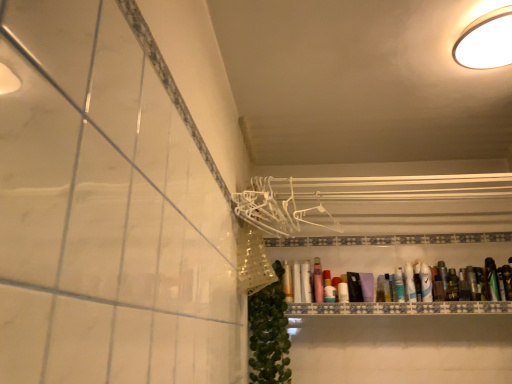
Measure the distance between white plastic bottle at upper right, positioned as the third toiletry in right-to-left order, and camera.

A distance of 6.83 feet exists between white plastic bottle at upper right, positioned as the third toiletry in right-to-left order, and camera.

What do you see at coordinates (287, 282) in the screenshot? The height and width of the screenshot is (384, 512). I see `gold metallic tube at upper center, placed as the 11th toiletry when sorted from right to left` at bounding box center [287, 282].

Identify the location of white plastic hanger at upper center, placed as the first hanger when sorted from right to left. The width and height of the screenshot is (512, 384). (315, 222).

How much space does white plastic hanger at upper center, the first hanger positioned from the left, occupy horizontally?

1.47 inches.

Locate an element on the screen. This screenshot has width=512, height=384. matte plastic bottles at center is located at coordinates (400, 308).

Measure the distance between matte pink lotion at center, which is the 4th toiletry from left to right, and camera.

6.79 feet.

You are a GUI agent. You are given a task and a screenshot of the screen. Output one action in this format:
    pyautogui.click(x=<x>, y=<y>)
    Task: Click on the white plastic bottle at upper right, positioned as the third toiletry in right-to-left order
    This screenshot has width=512, height=384.
    Given the screenshot: What is the action you would take?
    pyautogui.click(x=426, y=283)

From the picture: Is green matte bottle at right, which appears as the 11th toiletry when viewed from the left, at the back of translucent plastic bottle at upper right, positioned as the fifth toiletry in right-to-left order?

That's not correct — translucent plastic bottle at upper right, positioned as the fifth toiletry in right-to-left order, is not looking away from green matte bottle at right, which appears as the 11th toiletry when viewed from the left.

Is translucent plastic bottle at upper right, positioned as the fifth toiletry in right-to-left order, at the left side of green matte bottle at right, which is the 1th toiletry in right-to-left order?

Indeed, translucent plastic bottle at upper right, positioned as the fifth toiletry in right-to-left order, is positioned on the left side of green matte bottle at right, which is the 1th toiletry in right-to-left order.

Which object is closer to the camera, translucent plastic bottle at upper right, arranged as the seventh toiletry when viewed from the left, or green matte bottle at right, which is the 1th toiletry in right-to-left order?

green matte bottle at right, which is the 1th toiletry in right-to-left order, is in front.

Consider the image. Considering the sizes of translucent plastic bottle at upper right, positioned as the fifth toiletry in right-to-left order, and green matte bottle at right, which is the 1th toiletry in right-to-left order, in the image, is translucent plastic bottle at upper right, positioned as the fifth toiletry in right-to-left order, taller or shorter than green matte bottle at right, which is the 1th toiletry in right-to-left order,?

translucent plastic bottle at upper right, positioned as the fifth toiletry in right-to-left order, is shorter than green matte bottle at right, which is the 1th toiletry in right-to-left order.

Is white glossy light fixture at upper right to the right of white glossy bottle at center, marked as the 3th toiletry in a left-to-right arrangement, from the viewer's perspective?

Correct, you'll find white glossy light fixture at upper right to the right of white glossy bottle at center, marked as the 3th toiletry in a left-to-right arrangement.

Who is bigger, white glossy light fixture at upper right or white glossy bottle at center, marked as the 3th toiletry in a left-to-right arrangement?

Bigger between the two is white glossy light fixture at upper right.

From the image's perspective, which one is positioned higher, white glossy light fixture at upper right or white glossy bottle at center, arranged as the 9th toiletry when viewed from the right?

white glossy light fixture at upper right is shown above in the image.

This screenshot has height=384, width=512. What are the coordinates of `the 6th toiletry behind when counting from the white glossy light fixture at upper right` in the screenshot? It's located at (305, 283).

Can you confirm if white glossy bottle at upper right, which is the fourth toiletry in right-to-left order, is smaller than matte pink lotion at center, which is the 4th toiletry from left to right?

Yes.

Relative to matte pink lotion at center, the 8th toiletry in the right-to-left sequence, is white glossy bottle at upper right, which is the fourth toiletry in right-to-left order, in front or behind?

In the image, white glossy bottle at upper right, which is the fourth toiletry in right-to-left order, appears behind matte pink lotion at center, the 8th toiletry in the right-to-left sequence.

Is white glossy bottle at upper right, which ranks as the eighth toiletry in left-to-right order, positioned far away from matte pink lotion at center, which is the 4th toiletry from left to right?

Actually, white glossy bottle at upper right, which ranks as the eighth toiletry in left-to-right order, and matte pink lotion at center, which is the 4th toiletry from left to right, are a little close together.

From the image's perspective, is white glossy bottle at upper right, which ranks as the eighth toiletry in left-to-right order, positioned above or below matte pink lotion at center, which is the 4th toiletry from left to right?

From the image's perspective, white glossy bottle at upper right, which ranks as the eighth toiletry in left-to-right order, appears below matte pink lotion at center, which is the 4th toiletry from left to right.

Do you think green matte bottle at right, the second toiletry when ordered from right to left, is within green matte bottle at right, which is the 1th toiletry in right-to-left order, or outside of it?

green matte bottle at right, the second toiletry when ordered from right to left, exists outside the volume of green matte bottle at right, which is the 1th toiletry in right-to-left order.

Can you confirm if green matte bottle at right, the second toiletry when ordered from right to left, is shorter than green matte bottle at right, which is the 1th toiletry in right-to-left order?

Yes, green matte bottle at right, the second toiletry when ordered from right to left, is shorter than green matte bottle at right, which is the 1th toiletry in right-to-left order.

Is point (447, 292) in front of point (486, 260)?

Yes, it is.

From a real-world perspective, is green matte bottle at right, the second toiletry when ordered from right to left, beneath green matte bottle at right, which is the 1th toiletry in right-to-left order?

Yes.

In terms of height, does matte pink lotion at center, which is the 4th toiletry from left to right, look taller or shorter compared to white glossy bottle at center, arranged as the 9th toiletry when viewed from the right?

Considering their sizes, matte pink lotion at center, which is the 4th toiletry from left to right, has more height than white glossy bottle at center, arranged as the 9th toiletry when viewed from the right.

Based on the photo, what's the angular difference between matte pink lotion at center, the 8th toiletry in the right-to-left sequence, and white glossy bottle at center, marked as the 3th toiletry in a left-to-right arrangement,'s facing directions?

The facing directions of matte pink lotion at center, the 8th toiletry in the right-to-left sequence, and white glossy bottle at center, marked as the 3th toiletry in a left-to-right arrangement, are 0.00043 degrees apart.

Considering the positions of points (318, 269) and (306, 280), is point (318, 269) farther from camera compared to point (306, 280)?

That is True.

In the image, is matte pink lotion at center, the 8th toiletry in the right-to-left sequence, positioned in front of or behind white glossy bottle at center, arranged as the 9th toiletry when viewed from the right?

Visually, matte pink lotion at center, the 8th toiletry in the right-to-left sequence, is located in front of white glossy bottle at center, arranged as the 9th toiletry when viewed from the right.

Is point (329, 293) closer to viewer compared to point (343, 301)?

No, it is behind (343, 301).

Can matte plastic bottle at center, the 6th toiletry in the left-to-right sequence, be found inside translucent plastic container at center, placed as the 5th toiletry when sorted from left to right?

That's incorrect, matte plastic bottle at center, the 6th toiletry in the left-to-right sequence, is not inside translucent plastic container at center, placed as the 5th toiletry when sorted from left to right.

Where is `toiletry that is the 1st object above the translucent plastic container at center, placed as the seventh toiletry when sorted from right to left (from a real-world perspective)`? The width and height of the screenshot is (512, 384). toiletry that is the 1st object above the translucent plastic container at center, placed as the seventh toiletry when sorted from right to left (from a real-world perspective) is located at coordinates pos(343,292).

From the image's perspective, is translucent plastic container at center, placed as the 5th toiletry when sorted from left to right, located beneath matte plastic bottle at center, the 6th toiletry in the left-to-right sequence?

Yes, from the image's perspective, translucent plastic container at center, placed as the 5th toiletry when sorted from left to right, is below matte plastic bottle at center, the 6th toiletry in the left-to-right sequence.

Which is in front, point (424, 272) or point (272, 295)?

The point (272, 295) is more forward.

From the image's perspective, which one is positioned higher, white plastic bottle at upper right, positioned as the third toiletry in right-to-left order, or green leafy plant at lower center?

white plastic bottle at upper right, positioned as the third toiletry in right-to-left order, from the image's perspective.

In terms of height, does white plastic bottle at upper right, positioned as the third toiletry in right-to-left order, look taller or shorter compared to green leafy plant at lower center?

Clearly, white plastic bottle at upper right, positioned as the third toiletry in right-to-left order, is shorter compared to green leafy plant at lower center.

Which is behind, white plastic bottle at upper right, positioned as the 9th toiletry in left-to-right order, or green leafy plant at lower center?

white plastic bottle at upper right, positioned as the 9th toiletry in left-to-right order, is further away from the camera.

From a real-world perspective, starting from the translucent plastic bottle at upper right, positioned as the fifth toiletry in right-to-left order, which toiletry is the 8th one vertically above it? Please provide its 2D coordinates.

[(492, 278)]

Where is `light fixture above the white glossy bottle at center, arranged as the 9th toiletry when viewed from the right (from the image's perspective)`? This screenshot has height=384, width=512. light fixture above the white glossy bottle at center, arranged as the 9th toiletry when viewed from the right (from the image's perspective) is located at coordinates (486, 41).

Looking at the image, which one is located further to gold metallic tube at upper center, placed as the 11th toiletry when sorted from right to left, white glossy light fixture at upper right or white glossy bottle at center, marked as the 3th toiletry in a left-to-right arrangement?

white glossy light fixture at upper right.

From the image, which object appears to be nearer to white plastic hanger at upper center, the first hanger positioned from the left, green matte bottle at right, which is the 1th toiletry in right-to-left order, or white glossy bottle at center, arranged as the 9th toiletry when viewed from the right?

Based on the image, white glossy bottle at center, arranged as the 9th toiletry when viewed from the right, appears to be nearer to white plastic hanger at upper center, the first hanger positioned from the left.

Estimate the real-world distances between objects in this image. Which object is closer to green matte bottle at right, which is counted as the 10th toiletry, starting from the left, gold metallic tube at upper center, which is the 1th toiletry in left-to-right order, or matte pink lotion at center, which is the 4th toiletry from left to right?

Based on the image, matte pink lotion at center, which is the 4th toiletry from left to right, appears to be nearer to green matte bottle at right, which is counted as the 10th toiletry, starting from the left.

Looking at the image, which one is located further to matte pink lotion at center, the 8th toiletry in the right-to-left sequence, matte plastic bottles at center or matte plastic bottle at center, acting as the 6th toiletry starting from the right?

The object further to matte pink lotion at center, the 8th toiletry in the right-to-left sequence, is matte plastic bottles at center.

Based on their spatial positions, is translucent plastic container at center, placed as the seventh toiletry when sorted from right to left, or green leafy plant at lower center further from green matte bottle at right, which appears as the 11th toiletry when viewed from the left?

The object further to green matte bottle at right, which appears as the 11th toiletry when viewed from the left, is green leafy plant at lower center.

From the picture: Considering their positions, is white glossy light fixture at upper right positioned further to white plastic hanger at upper center, placed as the first hanger when sorted from right to left, than white glossy bottle at upper right, which is the fourth toiletry in right-to-left order?

Based on the image, white glossy light fixture at upper right appears to be further to white plastic hanger at upper center, placed as the first hanger when sorted from right to left.

From the image, which object appears to be farther from white glossy light fixture at upper right, white plastic hanger at upper center, the second hanger positioned from the left, or matte plastic bottle at center, the 6th toiletry in the left-to-right sequence?

Among the two, matte plastic bottle at center, the 6th toiletry in the left-to-right sequence, is located further to white glossy light fixture at upper right.

When comparing their distances from matte pink lotion at center, which is the 4th toiletry from left to right, does translucent plastic container at center, placed as the seventh toiletry when sorted from right to left, or gold metallic tube at upper center, which is the 1th toiletry in left-to-right order, seem further?

Based on the image, gold metallic tube at upper center, which is the 1th toiletry in left-to-right order, appears to be further to matte pink lotion at center, which is the 4th toiletry from left to right.

Locate an element on the screen. The width and height of the screenshot is (512, 384). ledge between matte pink lotion at center, which is the 4th toiletry from left to right, and green matte bottle at right, which is the 1th toiletry in right-to-left order, from left to right is located at coordinates pyautogui.click(x=400, y=308).

The image size is (512, 384). I want to click on hanger that lies between white plastic hanger at upper center, the 2th hanger when ordered from right to left, and green leafy plant at lower center from top to bottom, so coord(315,222).

Where is `ledge situated between matte plastic bottle at center, acting as the 6th toiletry starting from the right, and green matte bottle at right, which is the 1th toiletry in right-to-left order, from left to right`? This screenshot has height=384, width=512. ledge situated between matte plastic bottle at center, acting as the 6th toiletry starting from the right, and green matte bottle at right, which is the 1th toiletry in right-to-left order, from left to right is located at coordinates (400, 308).

Where is `ledge between clear plastic tube at center, the second toiletry when ordered from left to right, and white glossy bottle at upper right, which ranks as the eighth toiletry in left-to-right order`? This screenshot has height=384, width=512. ledge between clear plastic tube at center, the second toiletry when ordered from left to right, and white glossy bottle at upper right, which ranks as the eighth toiletry in left-to-right order is located at coordinates (400, 308).